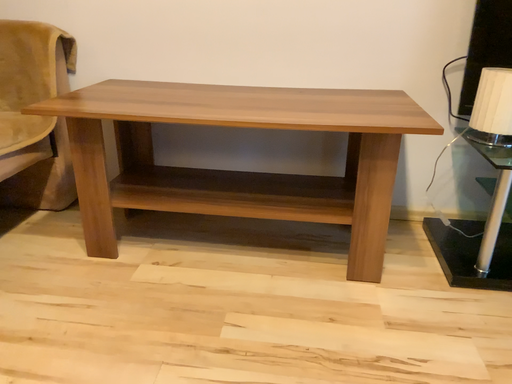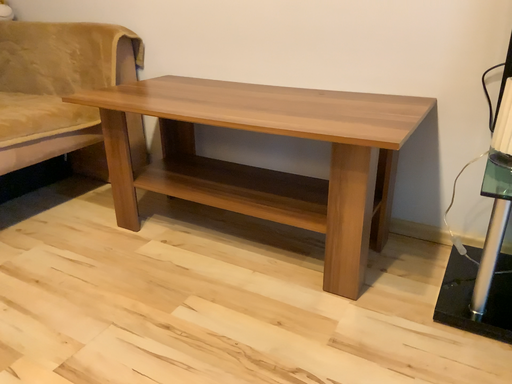
Question: Which way did the camera rotate in the video?

Choices:
 (A) rotated right
 (B) rotated left

Answer: (B)